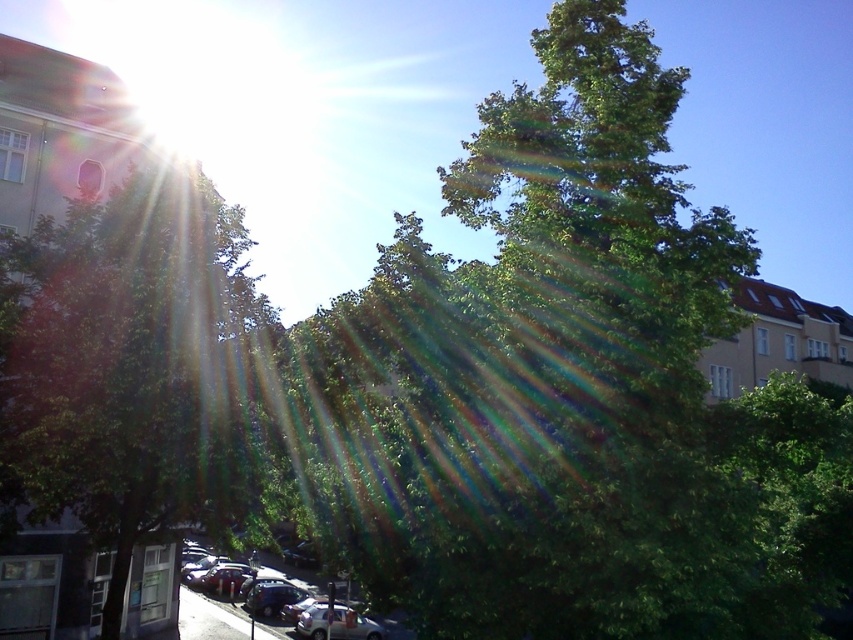
Does point (601, 42) come in front of point (258, 618)?

Yes, point (601, 42) is in front of point (258, 618).

How much distance is there between green leafy tree at center and shiny silver car at lower center?

green leafy tree at center is 14.10 meters away from shiny silver car at lower center.

Is point (671, 186) closer to viewer compared to point (267, 637)?

Yes, it is.

I want to click on green leafy tree at center, so click(569, 388).

Consider the image. Is green leafy tree at center positioned before green leafy tree at left?

Yes, it is.

Between green leafy tree at center and green leafy tree at left, which one is positioned higher?

green leafy tree at left

Which is behind, point (457, 168) or point (143, 579)?

Point (143, 579)

At what (x,y) coordinates should I click in order to perform the action: click on green leafy tree at center. Please return your answer as a coordinate pair (x, y). The width and height of the screenshot is (853, 640). Looking at the image, I should click on point(569,388).

Who is positioned more to the right, green leafy tree at left or shiny silver car at lower center?

Positioned to the right is green leafy tree at left.

Is green leafy tree at left shorter than shiny silver car at lower center?

No, green leafy tree at left is not shorter than shiny silver car at lower center.

Image resolution: width=853 pixels, height=640 pixels. What do you see at coordinates (134, 380) in the screenshot?
I see `green leafy tree at left` at bounding box center [134, 380].

Image resolution: width=853 pixels, height=640 pixels. In order to click on green leafy tree at left in this screenshot , I will do `click(134, 380)`.